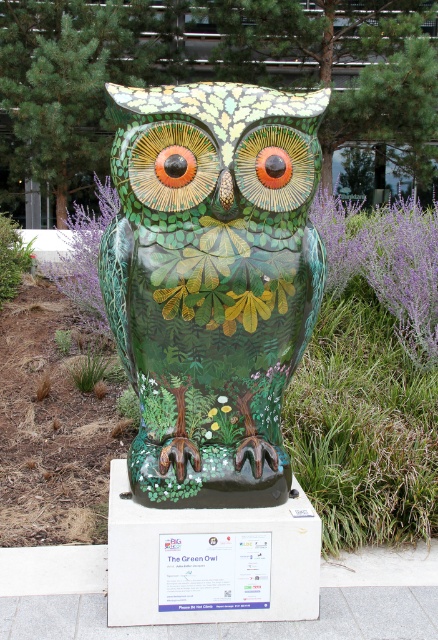
You are standing in front of the owl sculpture and want to place a small vase that is 1 meter tall on the ground. The vase needs to be placed exactly where the yellow matte flower at center is currently located. Is there enough space for the vase at that spot?

The yellow matte flower at center is located 2.67 meters away from the viewer. Since the vase is only 1 meter in height, there is sufficient vertical space for it at that location.

From the picture: You are an art curator planning to install a new sculpture in a garden. You see the large colorful owl sculpture and the yellow matte flower at center. Which object is located exactly at the coordinate point (211,412)?

The yellow matte flower at center is located exactly at the coordinate point (211,412).

You are standing in front of the owl sculpture and want to take a photo. There are two points marked on the ground at coordinates point (228,404) and point (215,422). Which point should you stand at to ensure the owl sculpture is fully visible in your photo without any obstructions?

You should stand at point (215,422) because point (228,404) is behind it, so standing at the latter might block the view of the owl sculpture.